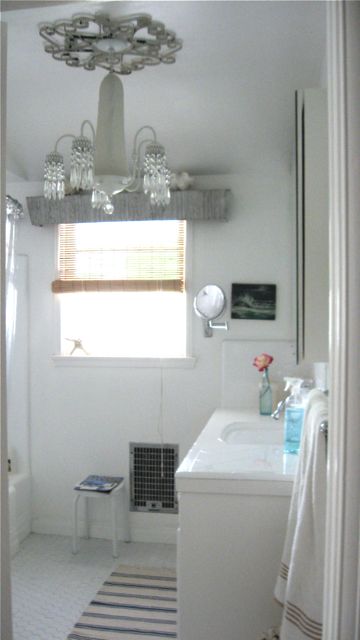
Image resolution: width=360 pixels, height=640 pixels. Find the location of `window`. window is located at coordinates (143, 313).